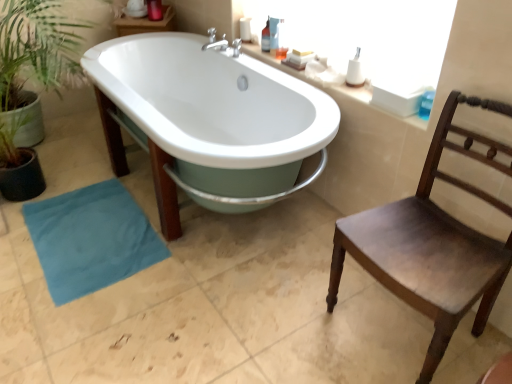
Question: Is teal fabric towel at lower left wider or thinner than translucent plastic bottle at upper right, marked as the 1th toiletry in a left-to-right arrangement?

Choices:
 (A) thin
 (B) wide

Answer: (B)

Question: From a real-world perspective, is teal fabric towel at lower left positioned above or below translucent plastic bottle at upper right, marked as the 1th toiletry in a left-to-right arrangement?

Choices:
 (A) below
 (B) above

Answer: (A)

Question: Which object is positioned farthest from the white plastic toothbrush at upper right, which is the 1th toiletry from right to left?

Choices:
 (A) translucent plastic bottle at upper right, the second toiletry viewed from the front
 (B) white glossy counter top at upper center
 (C) dark wood chair at right
 (D) white glossy bathtub at center
 (E) green leafy plant at left

Answer: (E)

Question: Estimate the real-world distances between objects in this image. Which object is farther from the teal fabric towel at lower left?

Choices:
 (A) white plastic toothbrush at upper right, arranged as the second toiletry when viewed from the back
 (B) translucent plastic bottle at upper right, the second toiletry viewed from the front
 (C) green leafy plant at left
 (D) white glossy bathtub at center
 (E) white glossy counter top at upper center

Answer: (A)